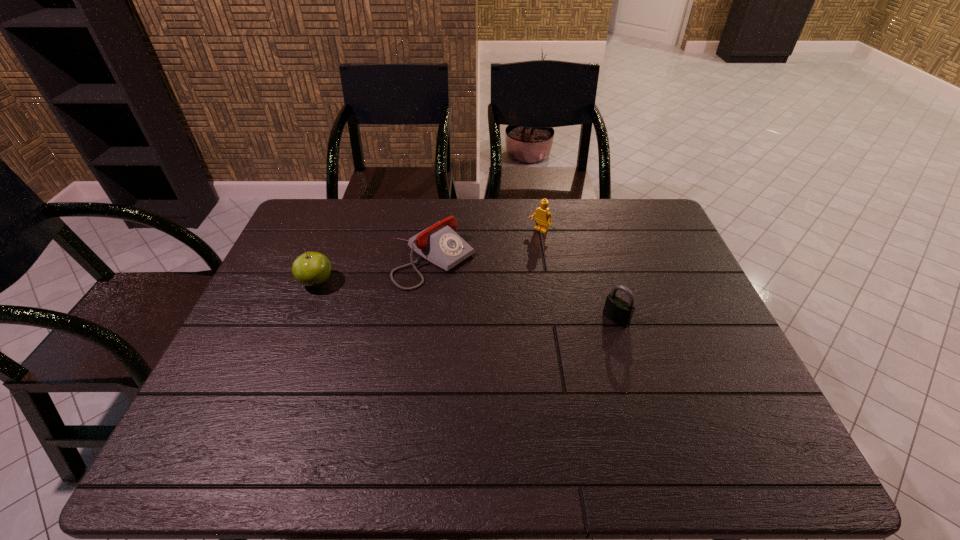
Where is `vacant area at the far right corner`? The image size is (960, 540). vacant area at the far right corner is located at coordinates (615, 199).

Where is `free spot at the near right corner of the desktop`? This screenshot has width=960, height=540. free spot at the near right corner of the desktop is located at coordinates (716, 418).

Find the location of `vacant point located between the second object from right to left and the shortest object`. vacant point located between the second object from right to left and the shortest object is located at coordinates (487, 245).

Identify the location of vacant area that lies between the shortest object and the leftmost object. Image resolution: width=960 pixels, height=540 pixels. (375, 271).

This screenshot has width=960, height=540. I want to click on free point between the nearest object and the shortest object, so (x=525, y=289).

At what (x,y) coordinates should I click in order to perform the action: click on free space between the third object from left to right and the nearest object. Please return your answer as a coordinate pair (x, y). The width and height of the screenshot is (960, 540). Looking at the image, I should click on (578, 275).

You are a GUI agent. You are given a task and a screenshot of the screen. Output one action in this format:
    pyautogui.click(x=<x>, y=<y>)
    Task: Click on the free space that is in between the leftmost object and the telephone
    
    Given the screenshot: What is the action you would take?
    pyautogui.click(x=375, y=271)

I want to click on vacant area that lies between the nearest object and the leftmost object, so click(466, 301).

You are a GUI agent. You are given a task and a screenshot of the screen. Output one action in this format:
    pyautogui.click(x=<x>, y=<y>)
    Task: Click on the free spot between the telephone and the padlock
    The height and width of the screenshot is (540, 960).
    Given the screenshot: What is the action you would take?
    pyautogui.click(x=525, y=289)

You are a GUI agent. You are given a task and a screenshot of the screen. Output one action in this format:
    pyautogui.click(x=<x>, y=<y>)
    Task: Click on the free space between the rightmost object and the telephone
    This screenshot has height=540, width=960.
    Given the screenshot: What is the action you would take?
    pyautogui.click(x=525, y=289)